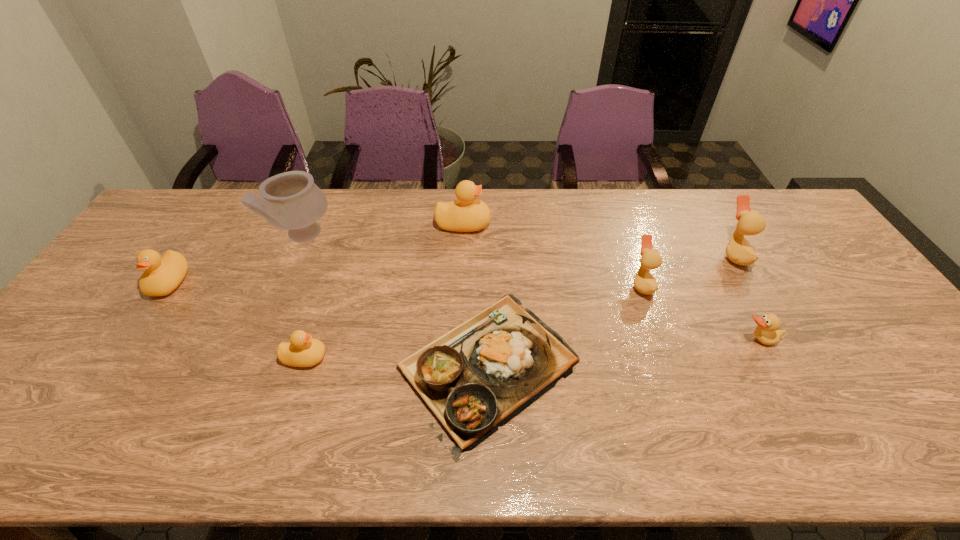
I want to click on free space located 0.300m on the beak of the second smallest tan duck, so click(527, 285).

Where is `vacant region located on the beak of the second smallest tan duck`? This screenshot has height=540, width=960. vacant region located on the beak of the second smallest tan duck is located at coordinates (513, 285).

Locate an element on the screen. The image size is (960, 540). free space located on the face of the second yellow duck from right to left is located at coordinates (479, 357).

Locate an element on the screen. vacant area situated 0.130m on the beak of the smallest tan duck is located at coordinates (787, 394).

At what (x,y) coordinates should I click in order to perform the action: click on free space located on the left of the platter. Please return your answer as a coordinate pair (x, y). Looking at the image, I should click on (353, 366).

The width and height of the screenshot is (960, 540). Identify the location of pottery that is at the far edge. (291, 200).

Locate an element on the screen. The width and height of the screenshot is (960, 540). duck positioned at the far edge is located at coordinates (465, 214).

This screenshot has height=540, width=960. Find the location of `object present at the near edge`. object present at the near edge is located at coordinates (476, 377).

You are a GUI agent. You are given a task and a screenshot of the screen. Output one action in this format:
    pyautogui.click(x=<x>, y=<y>)
    Task: Click on the object positioned at the left edge
    Image resolution: width=960 pixels, height=540 pixels.
    Given the screenshot: What is the action you would take?
    162,275

This screenshot has height=540, width=960. In the image, there is a desktop. Identify the location of vacant region at the far edge. (612, 224).